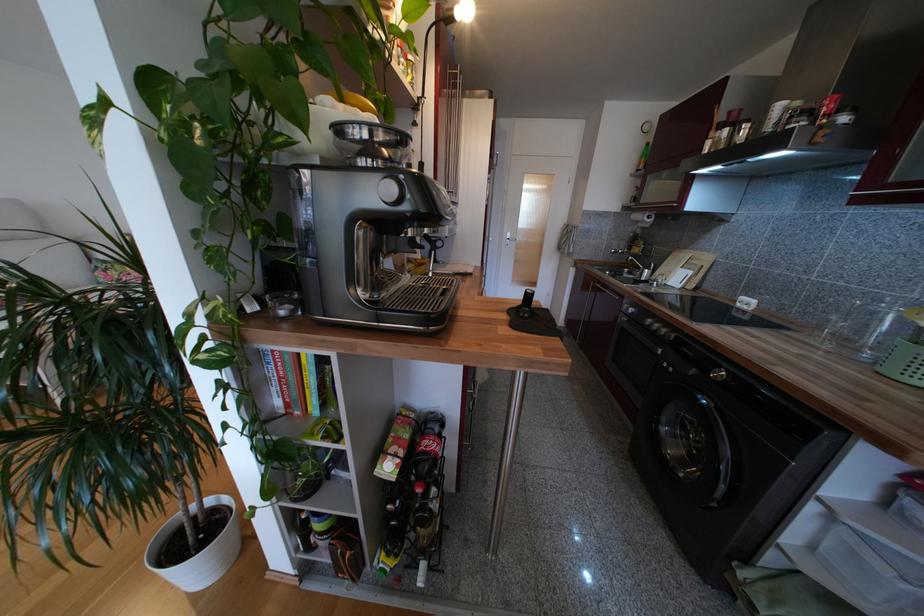
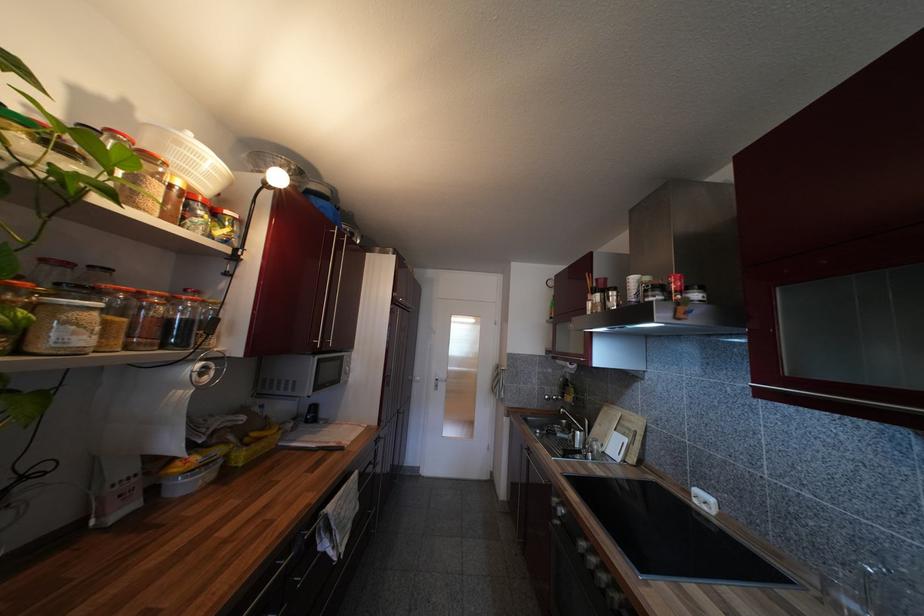
In the second image, find the point that corresponds to [661,328] in the first image.

(597, 562)